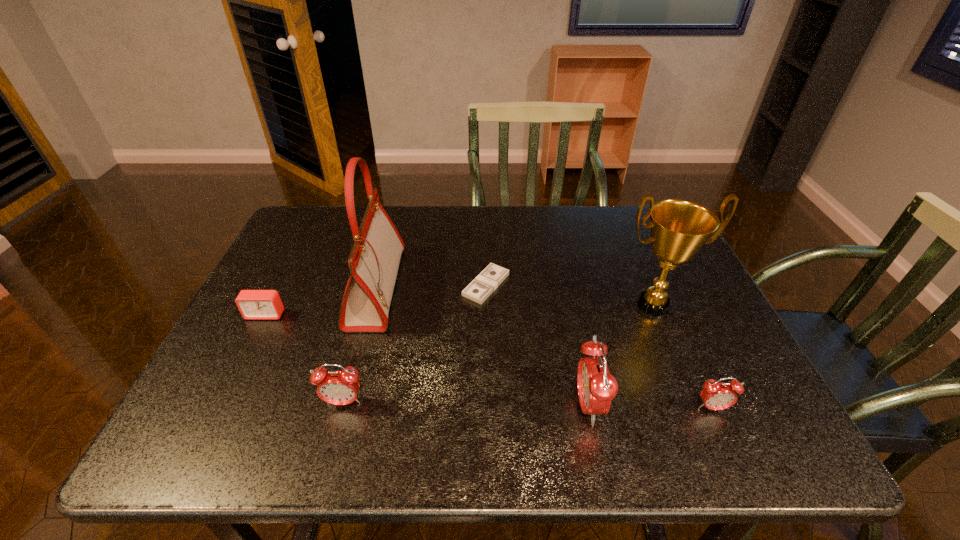
The height and width of the screenshot is (540, 960). Find the location of `alarm clock identified as the third closest to the third tallest object`. alarm clock identified as the third closest to the third tallest object is located at coordinates (253, 304).

Select which alarm clock is the third closest to the second alarm clock from right to left. Please provide its 2D coordinates. Your answer should be formatted as a tuple, i.e. [(x, y)], where the tuple contains the x and y coordinates of a point satisfying the conditions above.

[(253, 304)]

Locate an element on the screen. The width and height of the screenshot is (960, 540). blank space that satisfies the following two spatial constraints: 1. on the front view with handles of the award; 2. on the face of the third object from right to left is located at coordinates (696, 406).